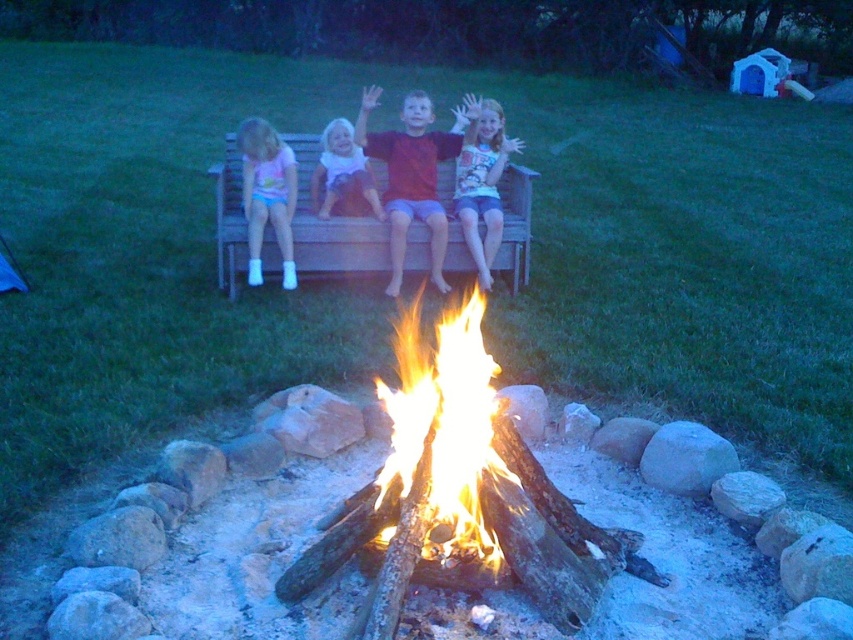
Question: Which point is closer to the camera taking this photo?

Choices:
 (A) (323, 212)
 (B) (433, 168)
 (C) (281, 168)

Answer: (C)

Question: Is matte pink shirt at center thinner than white cotton shirt at center?

Choices:
 (A) yes
 (B) no

Answer: (A)

Question: Is matte pink shirt at center above white cotton shirt at center?

Choices:
 (A) no
 (B) yes

Answer: (A)

Question: Which point appears farthest from the camera in this image?

Choices:
 (A) [x=256, y=268]
 (B) [x=408, y=156]
 (C) [x=479, y=275]

Answer: (B)

Question: Which of the following is the closest to the observer?

Choices:
 (A) flaming wood at center
 (B) white cotton shirt at center
 (C) matte pink shorts at left

Answer: (A)

Question: Is matte pink shirt at center below matte pink shorts at left?

Choices:
 (A) no
 (B) yes

Answer: (A)